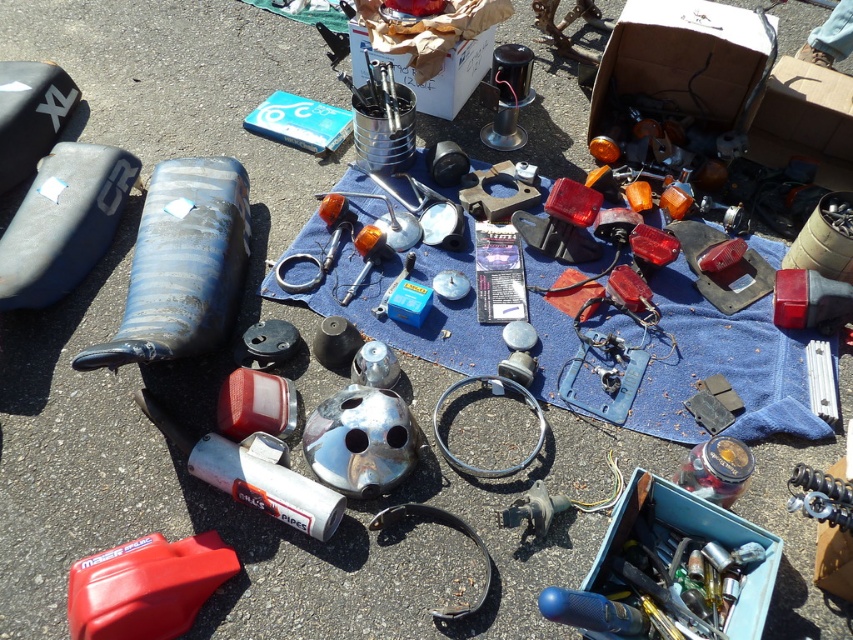
Question: Which object is farther from the camera taking this photo?

Choices:
 (A) metallic blue toolbox at lower right
 (B) blue fabric at center

Answer: (B)

Question: Does blue fabric at center appear on the right side of metallic blue toolbox at lower right?

Choices:
 (A) no
 (B) yes

Answer: (A)

Question: Based on their relative distances, which object is farther from the blue fabric at center?

Choices:
 (A) metallic blue toolbox at lower right
 (B) blue matte fuel tank at left

Answer: (B)

Question: Can you confirm if blue fabric at center is wider than blue matte fuel tank at left?

Choices:
 (A) yes
 (B) no

Answer: (A)

Question: Considering the real-world distances, which object is closest to the metallic blue toolbox at lower right?

Choices:
 (A) blue fabric at center
 (B) blue matte fuel tank at left

Answer: (A)

Question: Can you confirm if blue fabric at center is positioned to the left of blue matte fuel tank at left?

Choices:
 (A) yes
 (B) no

Answer: (B)